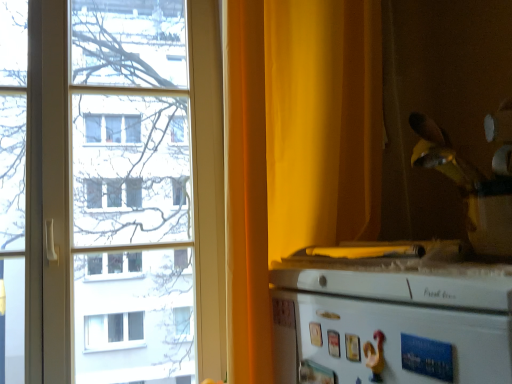
Question: Is transparent glass window at left wider than white glossy refrigerator at lower right?

Choices:
 (A) no
 (B) yes

Answer: (B)

Question: Can you confirm if transparent glass window at left is taller than white glossy refrigerator at lower right?

Choices:
 (A) no
 (B) yes

Answer: (B)

Question: Would you say white glossy refrigerator at lower right is part of transparent glass window at left's contents?

Choices:
 (A) no
 (B) yes

Answer: (A)

Question: Does transparent glass window at left have a lesser width compared to white glossy refrigerator at lower right?

Choices:
 (A) no
 (B) yes

Answer: (A)

Question: Is transparent glass window at left not inside white glossy refrigerator at lower right?

Choices:
 (A) no
 (B) yes

Answer: (B)

Question: Is transparent glass window at left in front of white glossy refrigerator at lower right?

Choices:
 (A) yes
 (B) no

Answer: (B)

Question: Is transparent glass window at left outside of yellow fabric curtain at right?

Choices:
 (A) no
 (B) yes

Answer: (B)

Question: Is transparent glass window at left oriented away from yellow fabric curtain at right?

Choices:
 (A) no
 (B) yes

Answer: (A)

Question: From the image's perspective, is transparent glass window at left under yellow fabric curtain at right?

Choices:
 (A) no
 (B) yes

Answer: (B)

Question: Can you confirm if transparent glass window at left is taller than yellow fabric curtain at right?

Choices:
 (A) no
 (B) yes

Answer: (B)

Question: Are transparent glass window at left and yellow fabric curtain at right far apart?

Choices:
 (A) no
 (B) yes

Answer: (B)

Question: Can you confirm if transparent glass window at left is bigger than yellow fabric curtain at right?

Choices:
 (A) yes
 (B) no

Answer: (B)

Question: Is white glossy refrigerator at lower right beside transparent glass window at left?

Choices:
 (A) yes
 (B) no

Answer: (B)